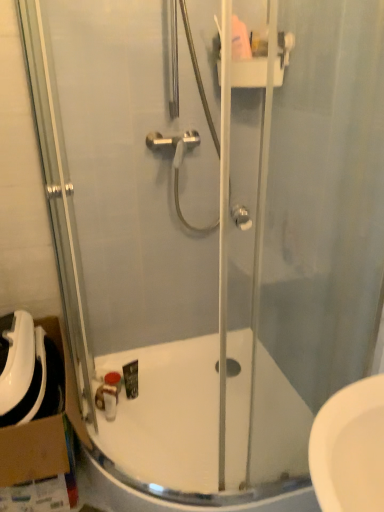
The height and width of the screenshot is (512, 384). Describe the element at coordinates (111, 394) in the screenshot. I see `matte brown soap at lower center` at that location.

You are a GUI agent. You are given a task and a screenshot of the screen. Output one action in this format:
    pyautogui.click(x=<x>, y=<y>)
    Task: Click on the white glossy bath at center
    Image resolution: width=384 pixels, height=512 pixels.
    Given the screenshot: What is the action you would take?
    pyautogui.click(x=203, y=424)

The height and width of the screenshot is (512, 384). What are the coordinates of `matte brown soap at lower center` in the screenshot? It's located at (111, 394).

Between white glossy bath at center and matte brown soap at lower center, which one has more height?

white glossy bath at center.

Does white glossy bath at center lie behind matte brown soap at lower center?

No, it is in front of matte brown soap at lower center.

Would you say white glossy bath at center is to the left or to the right of matte brown soap at lower center in the picture?

white glossy bath at center is positioned on matte brown soap at lower center's right side.

Based on the photo, which object is closer to the camera, white glossy bath at center or cardboard at left?

white glossy bath at center is more forward.

Is white glossy bath at center facing towards cardboard at left?

No, white glossy bath at center is not aimed at cardboard at left.

Identify the location of cardboard box on the left of white glossy bath at center. (33, 451).

Would you say white glossy bath at center is outside cardboard at left?

That's correct, white glossy bath at center is outside of cardboard at left.

Which point is more forward, [8,474] or [110,403]?

The point [8,474] is more forward.

Based on their positions, is cardboard at left located to the left or right of matte brown soap at lower center?

Clearly, cardboard at left is on the left of matte brown soap at lower center in the image.

Considering the positions of objects cardboard at left and matte brown soap at lower center in the image provided, who is behind, cardboard at left or matte brown soap at lower center?

matte brown soap at lower center is more distant.

You are a GUI agent. You are given a task and a screenshot of the screen. Output one action in this format:
    pyautogui.click(x=<x>, y=<y>)
    Task: Click on the bath in front of the matte brown soap at lower center
    The image size is (384, 512).
    Given the screenshot: What is the action you would take?
    pyautogui.click(x=203, y=424)

Considering the sizes of matte brown soap at lower center and white glossy bath at center in the image, is matte brown soap at lower center bigger or smaller than white glossy bath at center?

Clearly, matte brown soap at lower center is smaller in size than white glossy bath at center.

Which object is wider, matte brown soap at lower center or white glossy bath at center?

With larger width is white glossy bath at center.

Measure the distance from matte brown soap at lower center to white glossy bath at center.

matte brown soap at lower center is 15.31 inches from white glossy bath at center.

Image resolution: width=384 pixels, height=512 pixels. In the image, there is a white glossy bath at center. In order to click on cardboard box above it (from the image's perspective) in this screenshot , I will do `click(33, 451)`.

Is point (70, 391) closer to camera compared to point (184, 389)?

Yes, point (70, 391) is closer to viewer.

Who is more distant, cardboard at left or white glossy bath at center?

cardboard at left.

From a real-world perspective, is cardboard at left physically located above or below white glossy bath at center?

Clearly, from a real-world perspective, cardboard at left is above white glossy bath at center.

From the image's perspective, would you say matte brown soap at lower center is shown under cardboard at left?

Correct, matte brown soap at lower center appears lower than cardboard at left in the image.

Is matte brown soap at lower center in front of or behind cardboard at left in the image?

Visually, matte brown soap at lower center is located behind cardboard at left.

Does matte brown soap at lower center have a lesser width compared to cardboard at left?

Yes, matte brown soap at lower center is thinner than cardboard at left.

Looking at this image, which is more to the right, matte brown soap at lower center or cardboard at left?

Positioned to the right is matte brown soap at lower center.

Identify the location of toiletry above the white glossy bath at center (from a real-world perspective). (111, 394).

Where is `bath on the right of cardboard at left`? This screenshot has height=512, width=384. bath on the right of cardboard at left is located at coordinates (203, 424).

Based on their spatial positions, is matte brown soap at lower center or white glossy bath at center closer to cardboard at left?

Among the two, matte brown soap at lower center is located nearer to cardboard at left.

Estimate the real-world distances between objects in this image. Which object is closer to matte brown soap at lower center, cardboard at left or white glossy bath at center?

cardboard at left.

Which object lies further to the anchor point matte brown soap at lower center, white glossy bath at center or cardboard at left?

white glossy bath at center is further to matte brown soap at lower center.

From the image, which object appears to be nearer to white glossy bath at center, matte brown soap at lower center or cardboard at left?

The object closer to white glossy bath at center is matte brown soap at lower center.

Based on their spatial positions, is cardboard at left or matte brown soap at lower center further from white glossy bath at center?

cardboard at left is positioned further to the anchor white glossy bath at center.

From the image, which object appears to be nearer to cardboard at left, white glossy bath at center or matte brown soap at lower center?

matte brown soap at lower center is closer to cardboard at left.

Locate an element on the screen. This screenshot has height=512, width=384. toiletry between cardboard at left and white glossy bath at center is located at coordinates point(111,394).